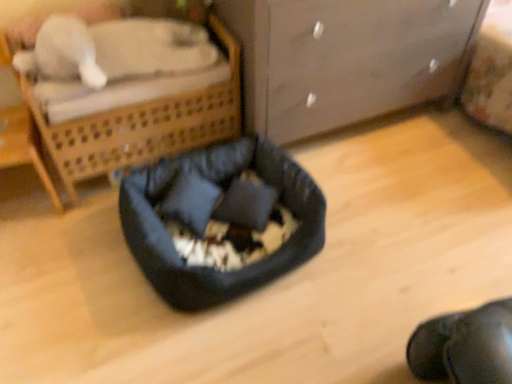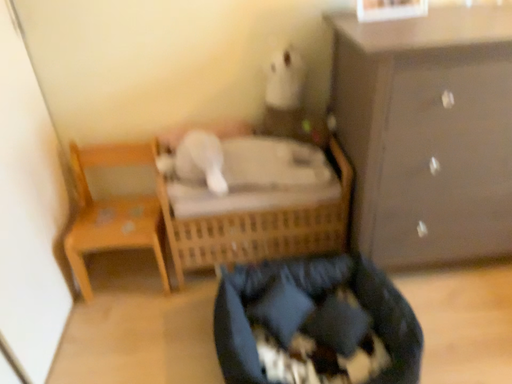
Question: How did the camera likely rotate when shooting the video?

Choices:
 (A) rotated right
 (B) rotated left

Answer: (B)